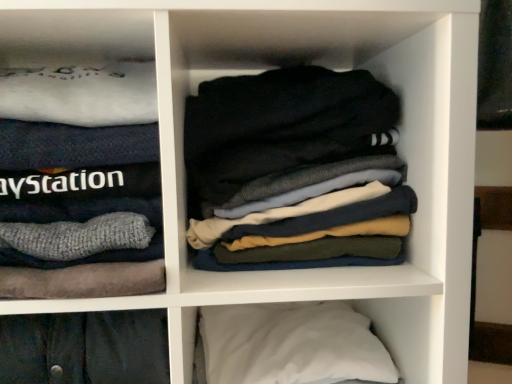
Question: Can you confirm if white soft sweater at left is shorter than white soft pillow at lower right?

Choices:
 (A) no
 (B) yes

Answer: (A)

Question: Considering the relative sizes of white soft sweater at left and white soft pillow at lower right in the image provided, is white soft sweater at left smaller than white soft pillow at lower right?

Choices:
 (A) yes
 (B) no

Answer: (B)

Question: Can white soft pillow at lower right be found inside white soft sweater at left?

Choices:
 (A) yes
 (B) no

Answer: (B)

Question: From the image's perspective, is white soft sweater at left located beneath white soft pillow at lower right?

Choices:
 (A) yes
 (B) no

Answer: (B)

Question: Considering the relative sizes of white soft sweater at left and white soft pillow at lower right in the image provided, is white soft sweater at left taller than white soft pillow at lower right?

Choices:
 (A) yes
 (B) no

Answer: (A)

Question: From the image's perspective, does white soft sweater at left appear higher than white soft pillow at lower right?

Choices:
 (A) yes
 (B) no

Answer: (A)

Question: Is dark gray cotton socks at center positioned in front of white soft pillow at lower right?

Choices:
 (A) no
 (B) yes

Answer: (A)

Question: From the image's perspective, is dark gray cotton socks at center over white soft pillow at lower right?

Choices:
 (A) yes
 (B) no

Answer: (A)

Question: Can you confirm if dark gray cotton socks at center is taller than white soft pillow at lower right?

Choices:
 (A) no
 (B) yes

Answer: (B)

Question: Considering the relative sizes of dark gray cotton socks at center and white soft pillow at lower right in the image provided, is dark gray cotton socks at center shorter than white soft pillow at lower right?

Choices:
 (A) no
 (B) yes

Answer: (A)

Question: Considering the relative sizes of dark gray cotton socks at center and white soft pillow at lower right in the image provided, is dark gray cotton socks at center bigger than white soft pillow at lower right?

Choices:
 (A) no
 (B) yes

Answer: (B)

Question: Does dark gray cotton socks at center lie behind white soft pillow at lower right?

Choices:
 (A) yes
 (B) no

Answer: (A)

Question: Is white soft pillow at lower right not close to dark gray cotton socks at center?

Choices:
 (A) yes
 (B) no

Answer: (B)